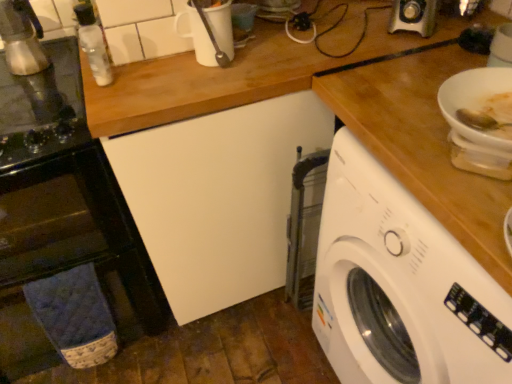
Find the location of a particular element. vacant area that is situated to the right of clear glass bottle at upper left is located at coordinates (144, 56).